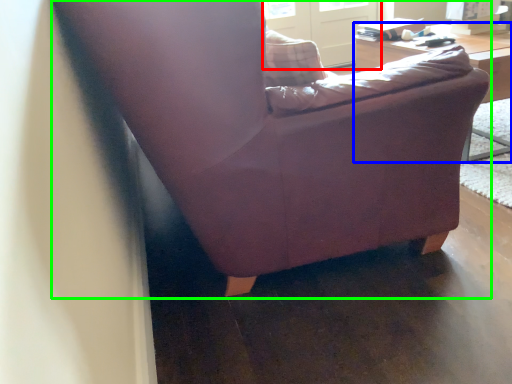
Question: Which is farther away from screen door (highlighted by a red box)? table (highlighted by a blue box) or chair (highlighted by a green box)?

Choices:
 (A) table
 (B) chair

Answer: (B)